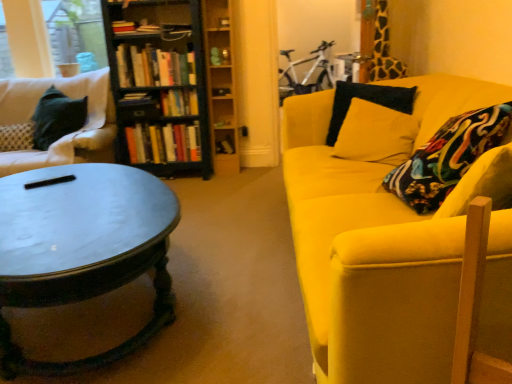
Question: Is white fabric couch at left, which is the first studio couch in back-to-front order, with wooden bookshelf at upper center, the 1th shelf viewed from the top?

Choices:
 (A) no
 (B) yes

Answer: (A)

Question: Is white fabric couch at left, acting as the 1th studio couch starting from the left, to the right of wooden bookshelf at upper center, the 1th shelf viewed from the top, from the viewer's perspective?

Choices:
 (A) no
 (B) yes

Answer: (A)

Question: Is white fabric couch at left, which is the second studio couch from right to left, taller than wooden bookshelf at upper center, the 1th shelf viewed from the top?

Choices:
 (A) yes
 (B) no

Answer: (A)

Question: Does white fabric couch at left, which is the second studio couch from right to left, have a lesser width compared to wooden bookshelf at upper center, positioned as the 2th shelf in bottom-to-top order?

Choices:
 (A) yes
 (B) no

Answer: (B)

Question: Is white fabric couch at left, acting as the 1th studio couch starting from the left, positioned behind wooden bookshelf at upper center, positioned as the 2th shelf in bottom-to-top order?

Choices:
 (A) no
 (B) yes

Answer: (A)

Question: Looking at the image, does hardcover book at center, the 3th book in the top-to-bottom sequence, seem bigger or smaller compared to hardcover book at center, marked as the 4th book in a top-to-bottom arrangement?

Choices:
 (A) small
 (B) big

Answer: (B)

Question: From the image's perspective, is hardcover book at center, the 3th book in the top-to-bottom sequence, above or below hardcover book at center, marked as the 4th book in a top-to-bottom arrangement?

Choices:
 (A) above
 (B) below

Answer: (A)

Question: In the image, is hardcover book at center, the 3th book in the top-to-bottom sequence, positioned in front of or behind hardcover book at center, positioned as the 3th book in bottom-to-top order?

Choices:
 (A) behind
 (B) front

Answer: (A)

Question: In the image, is hardcover book at center, the fourth book when ordered from bottom to top, on the left side or the right side of hardcover book at center, positioned as the 3th book in bottom-to-top order?

Choices:
 (A) left
 (B) right

Answer: (B)

Question: From the image's perspective, is hardcover books at center, which is the 5th book from top to bottom, above or below matte black coffee table at left?

Choices:
 (A) below
 (B) above

Answer: (B)

Question: Looking at their shapes, would you say hardcover books at center, which is the 5th book from top to bottom, is wider or thinner than matte black coffee table at left?

Choices:
 (A) thin
 (B) wide

Answer: (A)

Question: Is hardcover books at center, which is the 5th book from top to bottom, taller or shorter than matte black coffee table at left?

Choices:
 (A) short
 (B) tall

Answer: (A)

Question: From a real-world perspective, is hardcover books at center, which is the 5th book from top to bottom, physically located above or below matte black coffee table at left?

Choices:
 (A) below
 (B) above

Answer: (B)

Question: Considering their positions, is hardcover book at center, positioned as the 3th book in bottom-to-top order, located in front of or behind wooden shelf at center, arranged as the first shelf when ordered from the bottom?

Choices:
 (A) behind
 (B) front

Answer: (A)

Question: From a real-world perspective, relative to wooden shelf at center, arranged as the first shelf when ordered from the bottom, is hardcover book at center, positioned as the 3th book in bottom-to-top order, vertically above or below?

Choices:
 (A) below
 (B) above

Answer: (A)